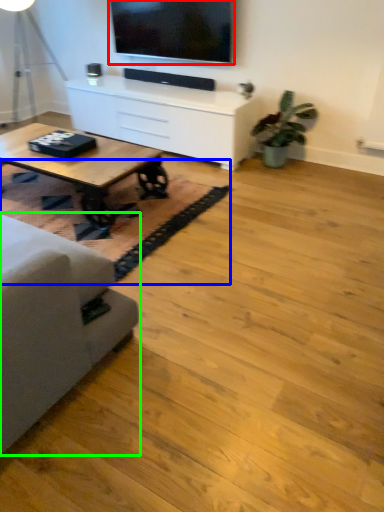
Question: Which object is the farthest from television (highlighted by a red box)? Choose among these: mat (highlighted by a blue box) or studio couch (highlighted by a green box).

Choices:
 (A) mat
 (B) studio couch

Answer: (B)